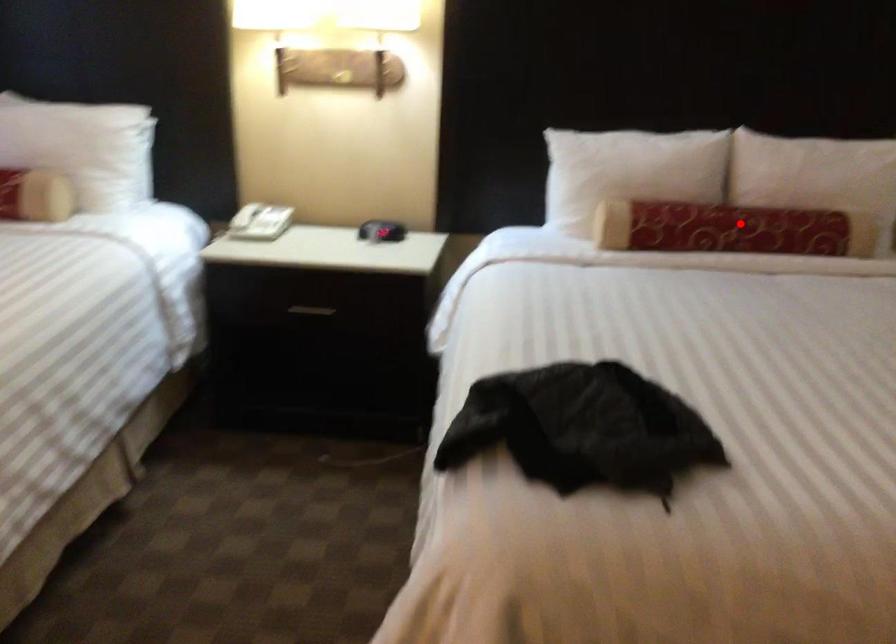
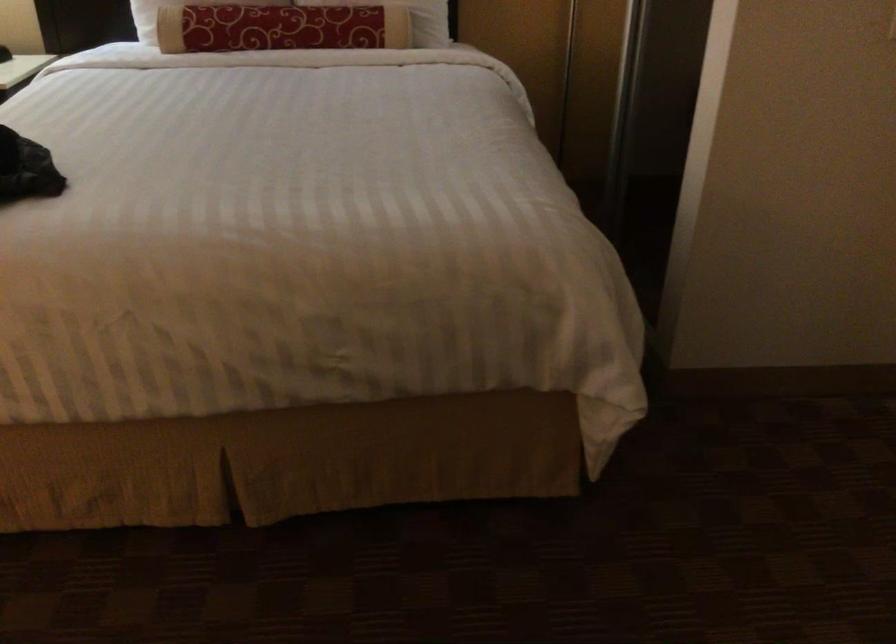
The point at the highlighted location is marked in the first image. Where is the corresponding point in the second image?

(280, 28)